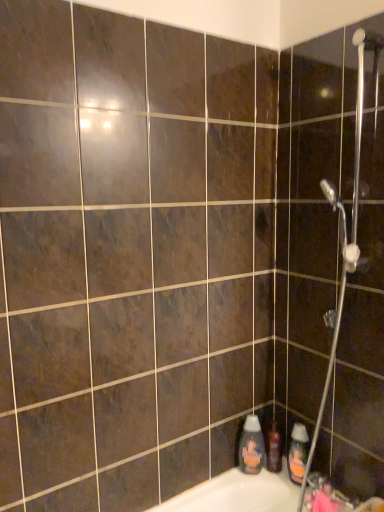
At what (x,y) coordinates should I click in order to perform the action: click on metallic silver shower head at upper right. Please return your answer as a coordinate pair (x, y). The width and height of the screenshot is (384, 512). Looking at the image, I should click on (362, 104).

The image size is (384, 512). What do you see at coordinates (325, 496) in the screenshot? I see `metallic silver faucet at lower right` at bounding box center [325, 496].

Find the location of `metallic silver faucet at lower right`. metallic silver faucet at lower right is located at coordinates (325, 496).

This screenshot has width=384, height=512. Describe the element at coordinates (251, 446) in the screenshot. I see `translucent plastic bottle at lower right, which is the 1th cleaning product in left-to-right order` at that location.

The height and width of the screenshot is (512, 384). What do you see at coordinates (297, 453) in the screenshot? I see `orange matte bottle at lower right, placed as the first cleaning product when sorted from right to left` at bounding box center [297, 453].

This screenshot has width=384, height=512. I want to click on metallic silver shower head at upper right, so click(x=362, y=104).

Between point (277, 435) and point (333, 340), which one is positioned in front?

The point (333, 340) is more forward.

Identify the location of toiletry that appears on the left of metallic silver shower head at upper right. (274, 449).

Between translucent plastic shampoo bottle at lower right and metallic silver shower head at upper right, which one is positioned in front?

metallic silver shower head at upper right is closer to the camera.

Is translucent plastic shampoo bottle at lower right at the right side of metallic silver shower head at upper right?

Incorrect, translucent plastic shampoo bottle at lower right is not on the right side of metallic silver shower head at upper right.

Is point (358, 50) positioned after point (303, 444)?

No, it is in front of (303, 444).

You are a GUI agent. You are given a task and a screenshot of the screen. Output one action in this format:
    pyautogui.click(x=<x>, y=<y>)
    Task: Click on the 2nd cleaning product below when counting from the metallic silver shower head at upper right (from the image's perspective)
    This screenshot has width=384, height=512.
    Given the screenshot: What is the action you would take?
    pyautogui.click(x=297, y=453)

How many degrees apart are the facing directions of metallic silver shower head at upper right and orange matte bottle at lower right, the second cleaning product in the left-to-right sequence?

0.369 degrees separate the facing orientations of metallic silver shower head at upper right and orange matte bottle at lower right, the second cleaning product in the left-to-right sequence.

From the image's perspective, between orange matte bottle at lower right, the second cleaning product in the left-to-right sequence, and translucent plastic bottle at lower right, the second cleaning product viewed from the right, who is located below?

orange matte bottle at lower right, the second cleaning product in the left-to-right sequence, appears lower in the image.

At what (x,y) coordinates should I click in order to perform the action: click on cleaning product behind the orange matte bottle at lower right, placed as the first cleaning product when sorted from right to left. Please return your answer as a coordinate pair (x, y). Looking at the image, I should click on (251, 446).

Is orange matte bottle at lower right, placed as the first cleaning product when sorted from right to left, next to translucent plastic bottle at lower right, which is the 1th cleaning product in left-to-right order, and touching it?

orange matte bottle at lower right, placed as the first cleaning product when sorted from right to left, and translucent plastic bottle at lower right, which is the 1th cleaning product in left-to-right order, are clearly separated.

Is orange matte bottle at lower right, placed as the first cleaning product when sorted from right to left, positioned with its back to translucent plastic bottle at lower right, the second cleaning product viewed from the right?

No, orange matte bottle at lower right, placed as the first cleaning product when sorted from right to left, is not facing the opposite direction of translucent plastic bottle at lower right, the second cleaning product viewed from the right.

What are the coordinates of `faucet on the right of the translucent plastic bottle at lower right, which is the 1th cleaning product in left-to-right order` in the screenshot? It's located at (325, 496).

From the image's perspective, which one is positioned higher, metallic silver faucet at lower right or translucent plastic bottle at lower right, which is the 1th cleaning product in left-to-right order?

From the image's view, translucent plastic bottle at lower right, which is the 1th cleaning product in left-to-right order, is above.

Is metallic silver faucet at lower right not close to translucent plastic bottle at lower right, the second cleaning product viewed from the right?

No.

Which object is positioned more to the right, metallic silver faucet at lower right or translucent plastic bottle at lower right, the second cleaning product viewed from the right?

metallic silver faucet at lower right.

Do you think metallic silver faucet at lower right is within translucent plastic shampoo bottle at lower right, or outside of it?

metallic silver faucet at lower right exists outside the volume of translucent plastic shampoo bottle at lower right.

Between metallic silver faucet at lower right and translucent plastic shampoo bottle at lower right, which one has smaller size?

translucent plastic shampoo bottle at lower right is smaller.

Would you say metallic silver faucet at lower right is to the left or to the right of translucent plastic shampoo bottle at lower right in the picture?

Based on their positions, metallic silver faucet at lower right is located to the right of translucent plastic shampoo bottle at lower right.

Looking at this image, is metallic silver faucet at lower right next to translucent plastic shampoo bottle at lower right and touching it?

No.

Who is shorter, translucent plastic bottle at lower right, the second cleaning product viewed from the right, or metallic silver shower head at upper right?

Standing shorter between the two is translucent plastic bottle at lower right, the second cleaning product viewed from the right.

Between translucent plastic bottle at lower right, the second cleaning product viewed from the right, and metallic silver shower head at upper right, which one has larger width?

Wider between the two is metallic silver shower head at upper right.

Would you consider translucent plastic bottle at lower right, the second cleaning product viewed from the right, to be distant from metallic silver shower head at upper right?

No, translucent plastic bottle at lower right, the second cleaning product viewed from the right, is in close proximity to metallic silver shower head at upper right.

Is translucent plastic bottle at lower right, the second cleaning product viewed from the right, inside the boundaries of metallic silver shower head at upper right, or outside?

translucent plastic bottle at lower right, the second cleaning product viewed from the right, is not inside metallic silver shower head at upper right, it's outside.

Is orange matte bottle at lower right, placed as the first cleaning product when sorted from right to left, closer to the viewer compared to metallic silver faucet at lower right?

No, the depth of orange matte bottle at lower right, placed as the first cleaning product when sorted from right to left, is greater than that of metallic silver faucet at lower right.

Is point (300, 476) less distant than point (324, 502)?

No, it is behind (324, 502).

Can you confirm if orange matte bottle at lower right, the second cleaning product in the left-to-right sequence, is taller than metallic silver faucet at lower right?

Yes, orange matte bottle at lower right, the second cleaning product in the left-to-right sequence, is taller than metallic silver faucet at lower right.

Locate an element on the screen. toiletry that appears behind the metallic silver shower head at upper right is located at coordinates (274, 449).

From the image's perspective, count 2nd cleaning products downward from the metallic silver shower head at upper right and point to it. Please provide its 2D coordinates.

[(297, 453)]

From the image, which object appears to be farther from orange matte bottle at lower right, the second cleaning product in the left-to-right sequence, metallic silver faucet at lower right or metallic silver shower head at upper right?

The object further to orange matte bottle at lower right, the second cleaning product in the left-to-right sequence, is metallic silver shower head at upper right.

Estimate the real-world distances between objects in this image. Which object is further from metallic silver faucet at lower right, orange matte bottle at lower right, the second cleaning product in the left-to-right sequence, or translucent plastic shampoo bottle at lower right?

Based on the image, translucent plastic shampoo bottle at lower right appears to be further to metallic silver faucet at lower right.

From the image, which object appears to be farther from translucent plastic bottle at lower right, the second cleaning product viewed from the right, translucent plastic shampoo bottle at lower right or orange matte bottle at lower right, placed as the first cleaning product when sorted from right to left?

orange matte bottle at lower right, placed as the first cleaning product when sorted from right to left, is positioned further to the anchor translucent plastic bottle at lower right, the second cleaning product viewed from the right.

Looking at the image, which one is located closer to translucent plastic shampoo bottle at lower right, orange matte bottle at lower right, placed as the first cleaning product when sorted from right to left, or translucent plastic bottle at lower right, the second cleaning product viewed from the right?

translucent plastic bottle at lower right, the second cleaning product viewed from the right, is closer to translucent plastic shampoo bottle at lower right.

When comparing their distances from metallic silver faucet at lower right, does metallic silver shower head at upper right or orange matte bottle at lower right, placed as the first cleaning product when sorted from right to left, seem further?

Based on the image, metallic silver shower head at upper right appears to be further to metallic silver faucet at lower right.

Based on their spatial positions, is metallic silver faucet at lower right or orange matte bottle at lower right, the second cleaning product in the left-to-right sequence, closer to translucent plastic bottle at lower right, the second cleaning product viewed from the right?

orange matte bottle at lower right, the second cleaning product in the left-to-right sequence, lies closer to translucent plastic bottle at lower right, the second cleaning product viewed from the right, than the other object.

From the picture: From the image, which object appears to be farther from metallic silver faucet at lower right, orange matte bottle at lower right, placed as the first cleaning product when sorted from right to left, or metallic silver shower head at upper right?

The object further to metallic silver faucet at lower right is metallic silver shower head at upper right.

Which object lies nearer to the anchor point translucent plastic shampoo bottle at lower right, metallic silver faucet at lower right or orange matte bottle at lower right, the second cleaning product in the left-to-right sequence?

The object closer to translucent plastic shampoo bottle at lower right is orange matte bottle at lower right, the second cleaning product in the left-to-right sequence.

Identify the location of toiletry between metallic silver shower head at upper right and metallic silver faucet at lower right vertically. (274, 449).

The height and width of the screenshot is (512, 384). I want to click on cleaning product that lies between metallic silver shower head at upper right and orange matte bottle at lower right, placed as the first cleaning product when sorted from right to left, from top to bottom, so click(251, 446).

Locate an element on the screen. This screenshot has width=384, height=512. cleaning product between metallic silver faucet at lower right and translucent plastic bottle at lower right, which is the 1th cleaning product in left-to-right order, along the z-axis is located at coordinates (297, 453).

At what (x,y) coordinates should I click in order to perform the action: click on toiletry located between translucent plastic bottle at lower right, the second cleaning product viewed from the right, and orange matte bottle at lower right, the second cleaning product in the left-to-right sequence, in the left-right direction. Please return your answer as a coordinate pair (x, y). This screenshot has height=512, width=384. Looking at the image, I should click on (274, 449).